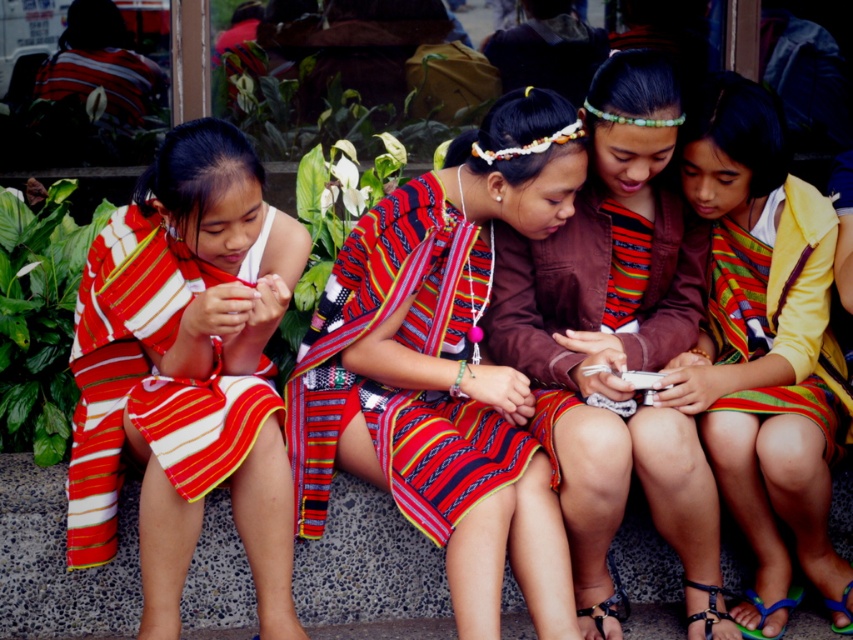
You are a photographer trying to capture a closeup of the matte brown jacket at center and the striped fabric dress at center. The camera you are using has a maximum focus range of 14 inches. Can you focus on both objects at the same time?

The matte brown jacket at center is 13.78 inches from the striped fabric dress at center, so yes, the camera can focus on both objects at the same time since the distance between them is within the 14 inches range.

Looking at this image, where is the striped fabric dress at left located in the image?

The striped fabric dress at left is located at point (196, 360) in the image.